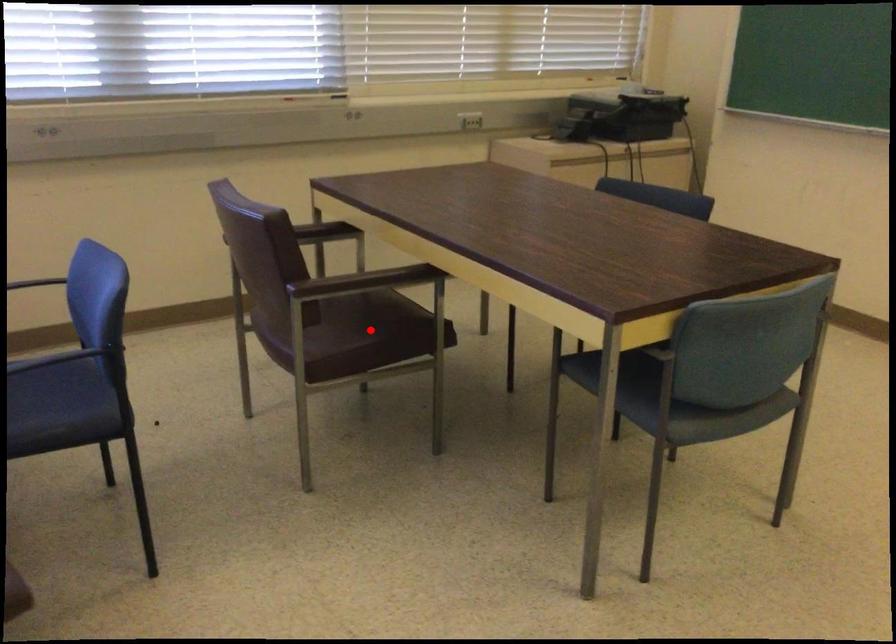
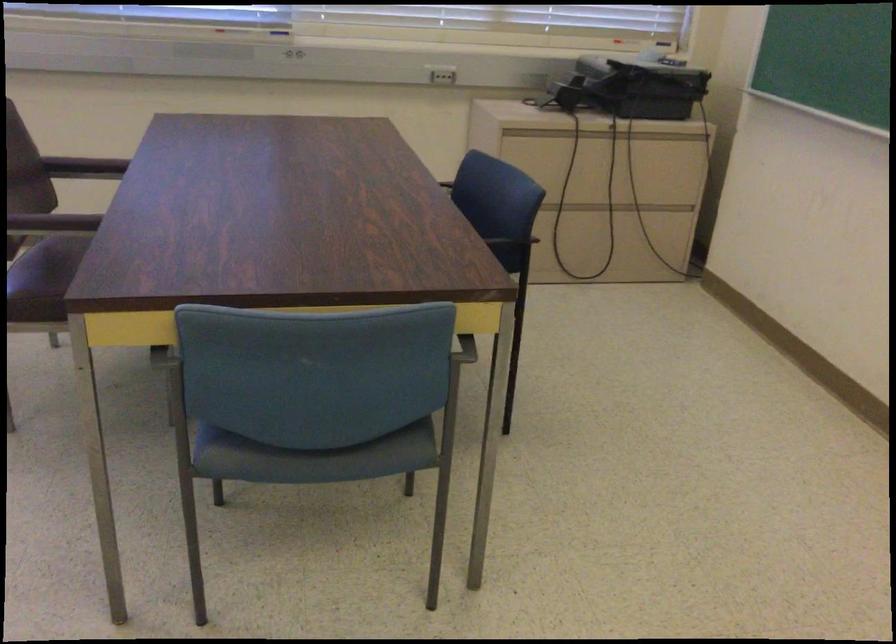
Question: I am providing you with two images of the same scene from different viewpoints. A red point is marked on the first image. At the location where the point appears in image 1, is it still visible in image 2?

Choices:
 (A) Yes
 (B) No

Answer: (B)